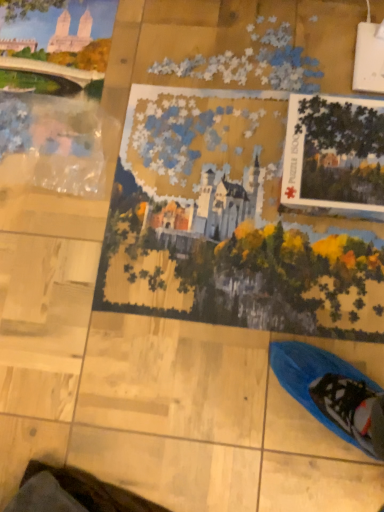
Locate an element on the screen. The image size is (384, 512). matte cardboard puzzle box at upper right is located at coordinates (334, 153).

Describe the element at coordinates (334, 153) in the screenshot. This screenshot has height=512, width=384. I see `matte cardboard puzzle box at upper right` at that location.

Where is `matte cardboard puzzle box at upper right`? matte cardboard puzzle box at upper right is located at coordinates pos(334,153).